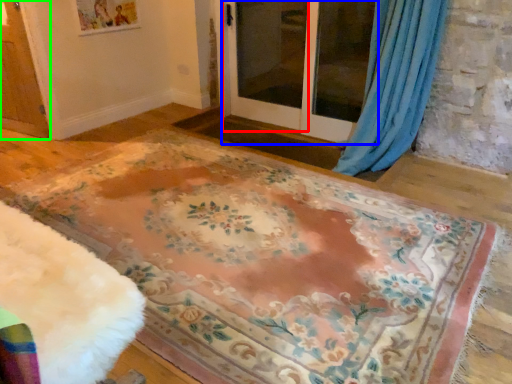
Question: Considering the real-world distances, which object is closest to screen door (highlighted by a red box)? screen door (highlighted by a blue box) or screen door (highlighted by a green box).

Choices:
 (A) screen door
 (B) screen door

Answer: (A)